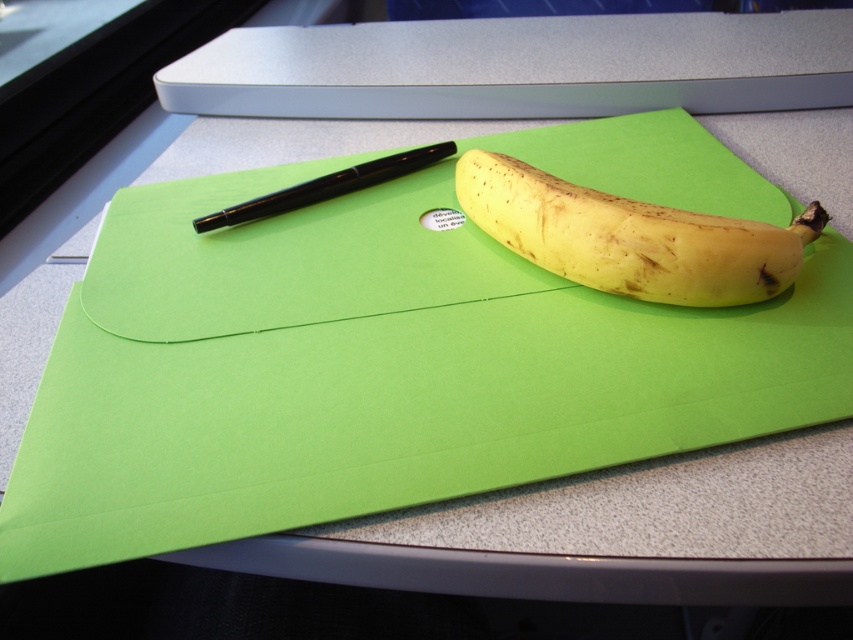
Consider the image. Can you confirm if green paper at center is smaller than black glossy pen at upper left?

No.

Is green paper at center below black glossy pen at upper left?

Yes, green paper at center is below black glossy pen at upper left.

The image size is (853, 640). Find the location of `green paper at center`. green paper at center is located at coordinates (370, 372).

Is yellow matte banana at center bigger than black glossy pen at upper left?

Yes.

Which is below, yellow matte banana at center or black glossy pen at upper left?

yellow matte banana at center is lower down.

Find the location of a particular element. yellow matte banana at center is located at coordinates (630, 236).

The image size is (853, 640). I want to click on yellow matte banana at center, so click(x=630, y=236).

Based on the photo, can you confirm if green paper at center is thinner than yellow matte banana at center?

No, green paper at center is not thinner than yellow matte banana at center.

Is point (45, 403) less distant than point (497, 160)?

That is True.

Identify the location of green paper at center. (370, 372).

Find the location of a particular element. green paper at center is located at coordinates (370, 372).